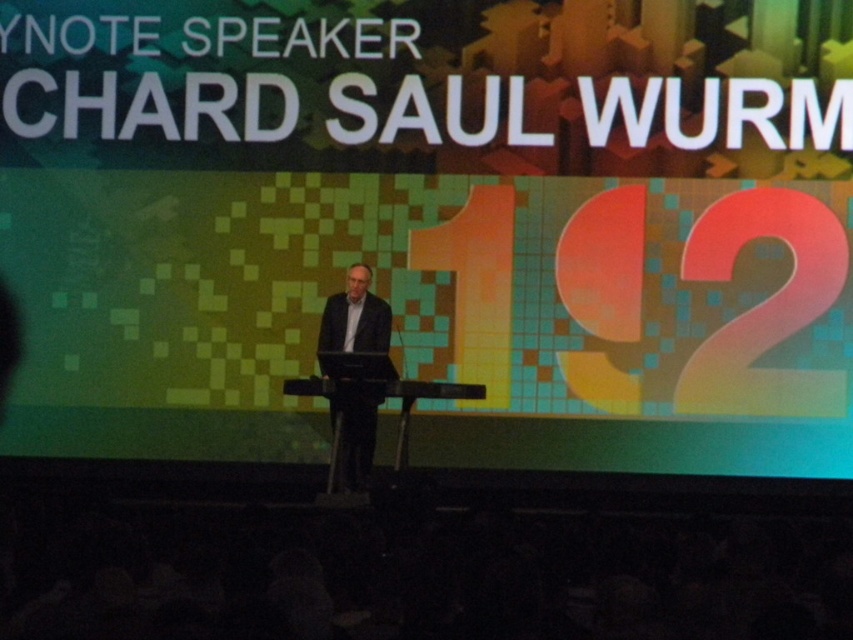
Can you confirm if dark suit at center is shorter than black plastic podium at center?

Incorrect, dark suit at center's height does not fall short of black plastic podium at center's.

Is dark suit at center bigger than black plastic podium at center?

No, dark suit at center is not bigger than black plastic podium at center.

I want to click on dark suit at center, so click(355, 317).

What are the coordinates of `dark suit at center` in the screenshot? It's located at (355, 317).